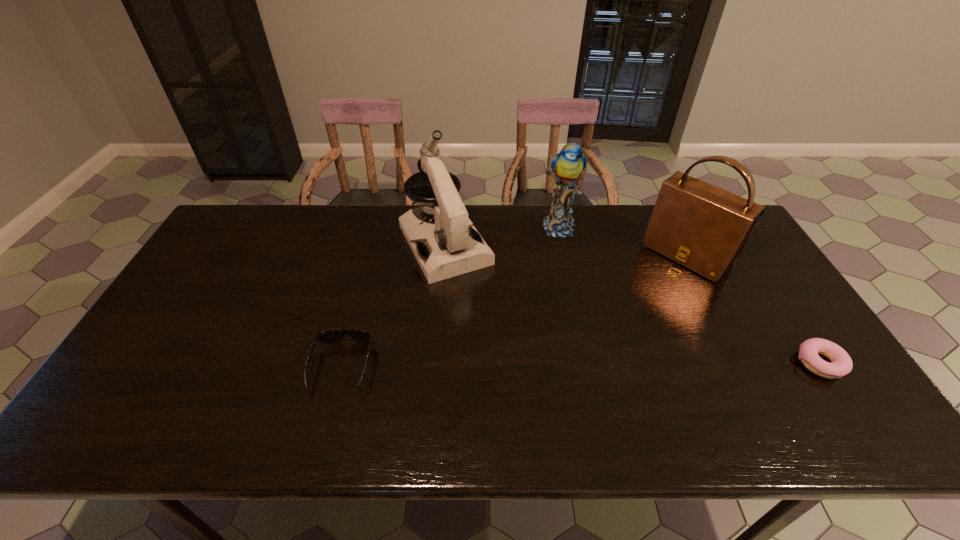
At what (x,y) coordinates should I click in order to perform the action: click on free space located 0.310m on the front flap of the shoulder bag. Please return your answer as a coordinate pair (x, y). The image size is (960, 540). Looking at the image, I should click on (608, 330).

Where is `free space located on the front flap of the shoulder bag`? This screenshot has height=540, width=960. free space located on the front flap of the shoulder bag is located at coordinates (603, 334).

The image size is (960, 540). I want to click on vacant space located on the front flap of the shoulder bag, so click(656, 285).

Where is `vacant region located 0.370m on the face of the parrot`? vacant region located 0.370m on the face of the parrot is located at coordinates (606, 328).

Where is `vacant space located 0.340m on the face of the parrot`? Image resolution: width=960 pixels, height=540 pixels. vacant space located 0.340m on the face of the parrot is located at coordinates (602, 320).

Find the location of a particular element. This screenshot has width=960, height=540. vacant space located 0.160m on the face of the parrot is located at coordinates (580, 275).

This screenshot has width=960, height=540. Identify the location of microscope located at the far edge. (451, 246).

Locate an element on the screen. The image size is (960, 540). shoulder bag that is at the far edge is located at coordinates (703, 227).

At what (x,y) coordinates should I click in order to perform the action: click on parrot present at the far edge. Please return your answer as a coordinate pair (x, y). Looking at the image, I should click on (567, 165).

Where is `sunglasses that is positioned at the near edge`? This screenshot has height=540, width=960. sunglasses that is positioned at the near edge is located at coordinates (334, 335).